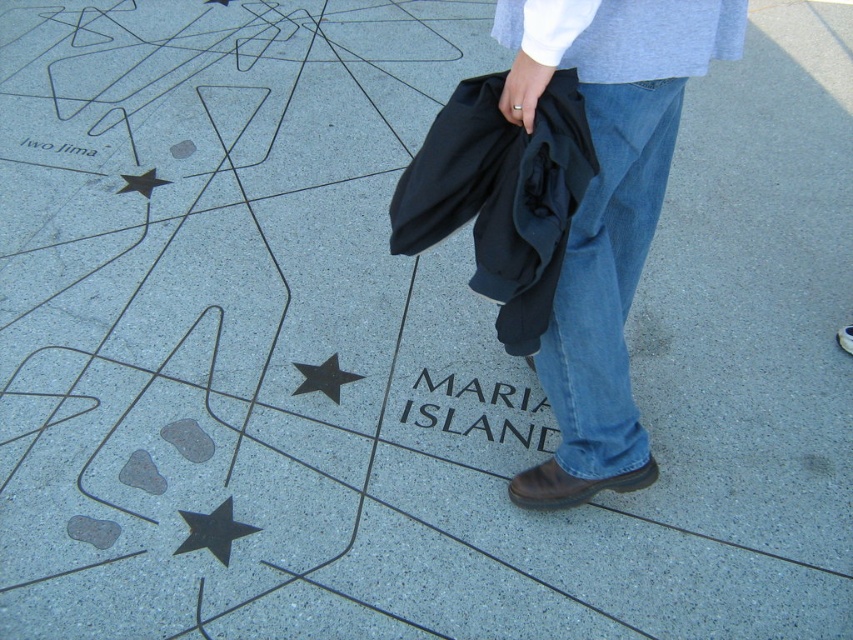
Question: From the image, what is the correct spatial relationship of denim at center in relation to black granite at center?

Choices:
 (A) left
 (B) right

Answer: (B)

Question: Is black polished star at lower left below metallic star at center?

Choices:
 (A) no
 (B) yes

Answer: (B)

Question: Which of the following is the farthest from the observer?

Choices:
 (A) (614, 36)
 (B) (590, 116)

Answer: (B)

Question: Which point appears farthest from the camera in this image?

Choices:
 (A) (549, 445)
 (B) (131, 189)

Answer: (B)

Question: Can you confirm if black granite at center is wider than metallic star at center?

Choices:
 (A) no
 (B) yes

Answer: (B)

Question: Which of the following is the farthest from the observer?

Choices:
 (A) (308, 371)
 (B) (505, 42)
 (C) (569, 243)

Answer: (A)